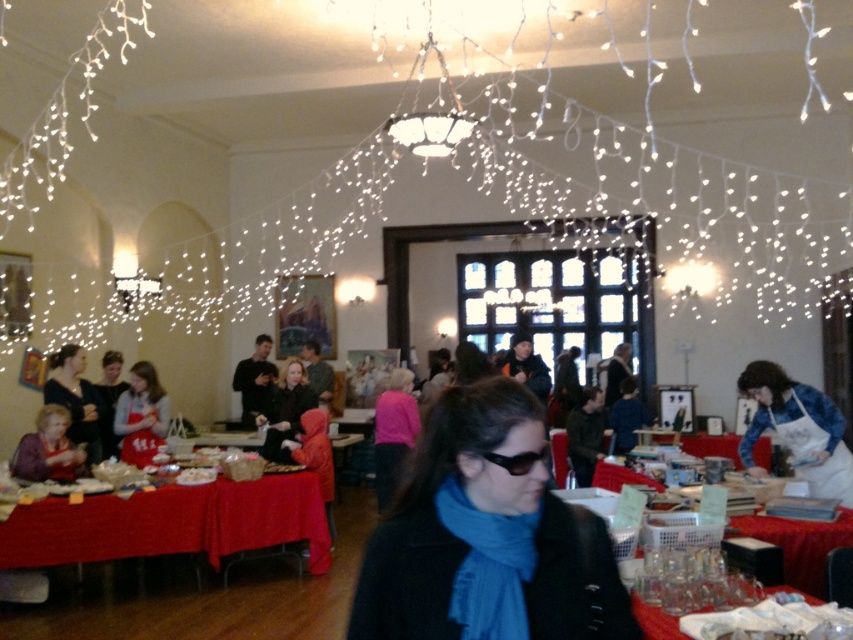
Does white apron at right come behind black plastic goggles at center?

Yes, it is.

Between point (817, 467) and point (537, 458), which one is positioned in front?

Point (537, 458) is more forward.

This screenshot has height=640, width=853. What are the coordinates of `white apron at right` in the screenshot? It's located at (798, 429).

Does black matte coat at center come in front of red apron at center?

Yes, it is in front of red apron at center.

Which is above, black matte coat at center or red apron at center?

Positioned higher is black matte coat at center.

This screenshot has height=640, width=853. I want to click on black matte coat at center, so click(486, 538).

Looking at this image, can you confirm if red apron at center is shorter than matte black jacket at center?

Yes, red apron at center is shorter than matte black jacket at center.

Measure the distance between red apron at center and camera.

red apron at center and camera are 5.92 meters apart.

You are a GUI agent. You are given a task and a screenshot of the screen. Output one action in this format:
    pyautogui.click(x=<x>, y=<y>)
    Task: Click on the red apron at center
    This screenshot has width=853, height=640.
    Given the screenshot: What is the action you would take?
    pyautogui.click(x=141, y=416)